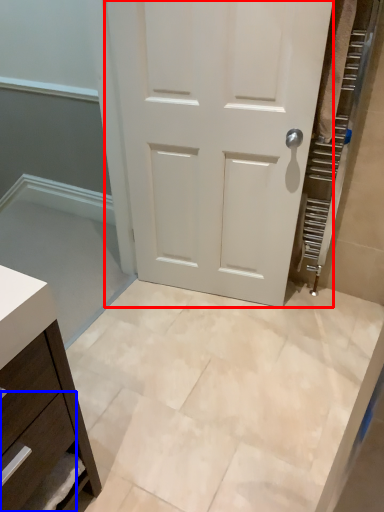
Question: Which point is closer to the camera, door (highlighted by a red box) or drawer (highlighted by a blue box)?

Choices:
 (A) door
 (B) drawer

Answer: (B)